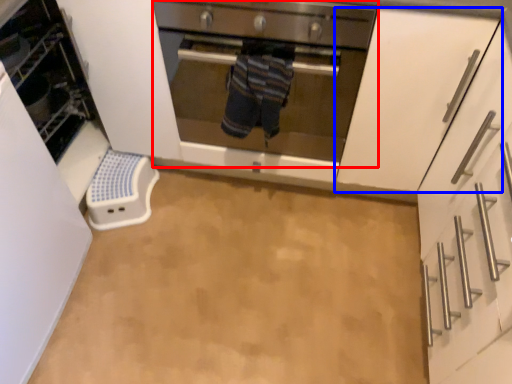
Question: Which object is closer to the camera taking this photo, oven (highlighted by a red box) or cabinetry (highlighted by a blue box)?

Choices:
 (A) oven
 (B) cabinetry

Answer: (B)